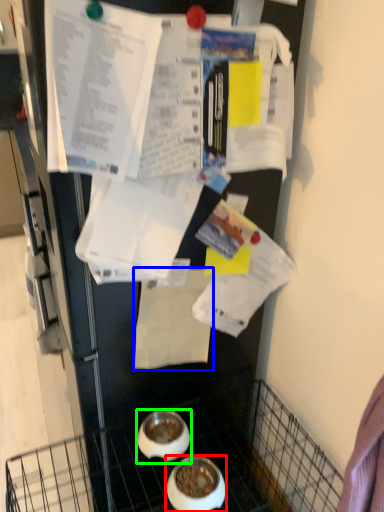
Question: Which is farther away from bowl (highlighted by a red box)? paper (highlighted by a blue box) or bowl (highlighted by a green box)?

Choices:
 (A) paper
 (B) bowl

Answer: (A)